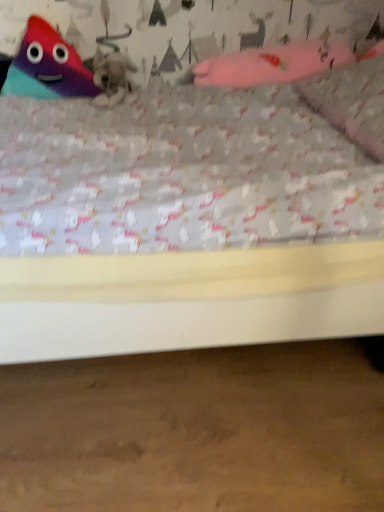
Question: Considering the relative sizes of matte plastic triangle at upper left, the 1th toy viewed from the left, and fuzzy gray cat at upper center in the image provided, is matte plastic triangle at upper left, the 1th toy viewed from the left, taller than fuzzy gray cat at upper center?

Choices:
 (A) no
 (B) yes

Answer: (B)

Question: Can you confirm if matte plastic triangle at upper left, which appears as the 2th toy when viewed from the right, is bigger than fuzzy gray cat at upper center?

Choices:
 (A) yes
 (B) no

Answer: (A)

Question: From the image's perspective, is matte plastic triangle at upper left, the 1th toy viewed from the left, located beneath fuzzy gray cat at upper center?

Choices:
 (A) yes
 (B) no

Answer: (B)

Question: Is matte plastic triangle at upper left, which appears as the 2th toy when viewed from the right, to the left of fuzzy gray cat at upper center from the viewer's perspective?

Choices:
 (A) no
 (B) yes

Answer: (B)

Question: From a real-world perspective, is matte plastic triangle at upper left, which appears as the 2th toy when viewed from the right, positioned under fuzzy gray cat at upper center based on gravity?

Choices:
 (A) yes
 (B) no

Answer: (B)

Question: Relative to matte plastic triangle at upper left, the 1th toy viewed from the left, is pink fabric glove at upper right, which ranks as the 1th toy in right-to-left order, in front or behind?

Choices:
 (A) front
 (B) behind

Answer: (A)

Question: Considering the positions of point (349, 50) and point (46, 30), is point (349, 50) closer or farther from the camera than point (46, 30)?

Choices:
 (A) farther
 (B) closer

Answer: (A)

Question: In terms of width, does pink fabric glove at upper right, which ranks as the 1th toy in right-to-left order, look wider or thinner when compared to matte plastic triangle at upper left, the 1th toy viewed from the left?

Choices:
 (A) wide
 (B) thin

Answer: (A)

Question: Choose the correct answer: Is pink fabric glove at upper right, the second toy from the left, inside matte plastic triangle at upper left, the 1th toy viewed from the left, or outside it?

Choices:
 (A) inside
 (B) outside

Answer: (B)

Question: Is fuzzy gray cat at upper center inside or outside of pink fabric pillow at upper right?

Choices:
 (A) outside
 (B) inside

Answer: (A)

Question: From a real-world perspective, relative to pink fabric pillow at upper right, is fuzzy gray cat at upper center vertically above or below?

Choices:
 (A) above
 (B) below

Answer: (B)

Question: Considering their positions, is fuzzy gray cat at upper center located in front of or behind pink fabric pillow at upper right?

Choices:
 (A) behind
 (B) front

Answer: (A)

Question: Is point (107, 83) closer or farther from the camera than point (379, 115)?

Choices:
 (A) closer
 (B) farther

Answer: (B)

Question: From a real-world perspective, is pink fabric pillow at upper right above or below matte plastic triangle at upper left, which appears as the 2th toy when viewed from the right?

Choices:
 (A) below
 (B) above

Answer: (A)

Question: Is pink fabric pillow at upper right taller or shorter than matte plastic triangle at upper left, which appears as the 2th toy when viewed from the right?

Choices:
 (A) short
 (B) tall

Answer: (A)